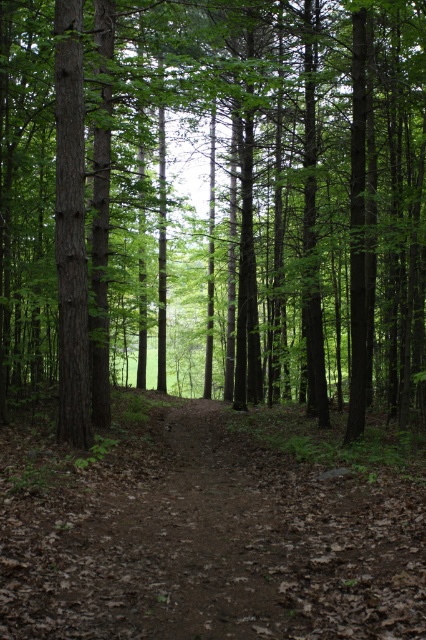
You are a hiker planning to take a photo of the brown wood tree at center and the brown dirt trail at center from a distance. Which object will appear larger in the photo?

The brown wood tree at center will appear larger in the photo because it is much taller than the brown dirt trail at center.

You are a hiker carrying a backpack and need to walk along the brown dirt trail at center while avoiding the brown wood tree at center. Can you pass through without needing to move sideways?

The brown wood tree at center is wider than the brown dirt trail at center, so you will need to move sideways to avoid colliding with the tree.